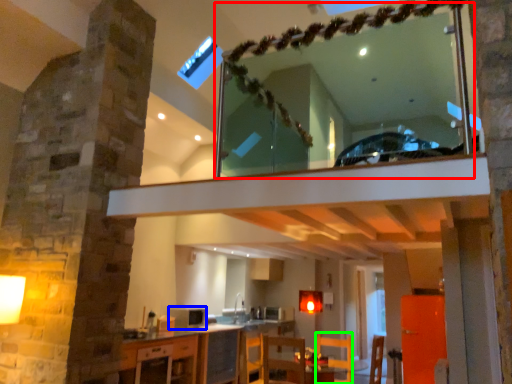
Question: Which object is the closest to the mirror (highlighted by a red box)? Choose among these: appliance (highlighted by a blue box) or armchair (highlighted by a green box).

Choices:
 (A) appliance
 (B) armchair

Answer: (B)